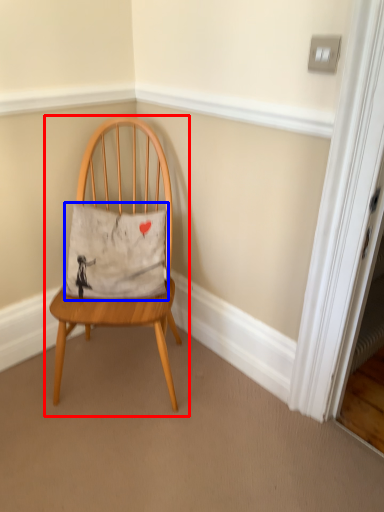
Question: Among these objects, which one is farthest to the camera, chair (highlighted by a red box) or pillow (highlighted by a blue box)?

Choices:
 (A) chair
 (B) pillow

Answer: (B)